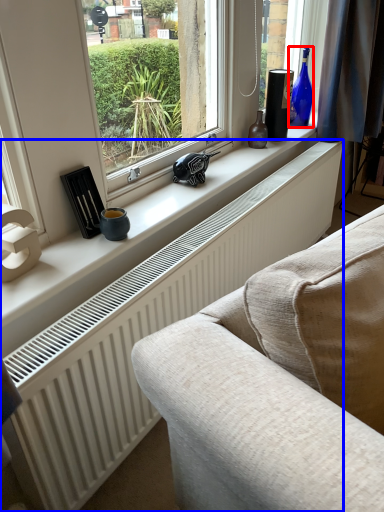
Question: Which object is further to the camera taking this photo, bottle (highlighted by a red box) or radiator (highlighted by a blue box)?

Choices:
 (A) bottle
 (B) radiator

Answer: (A)